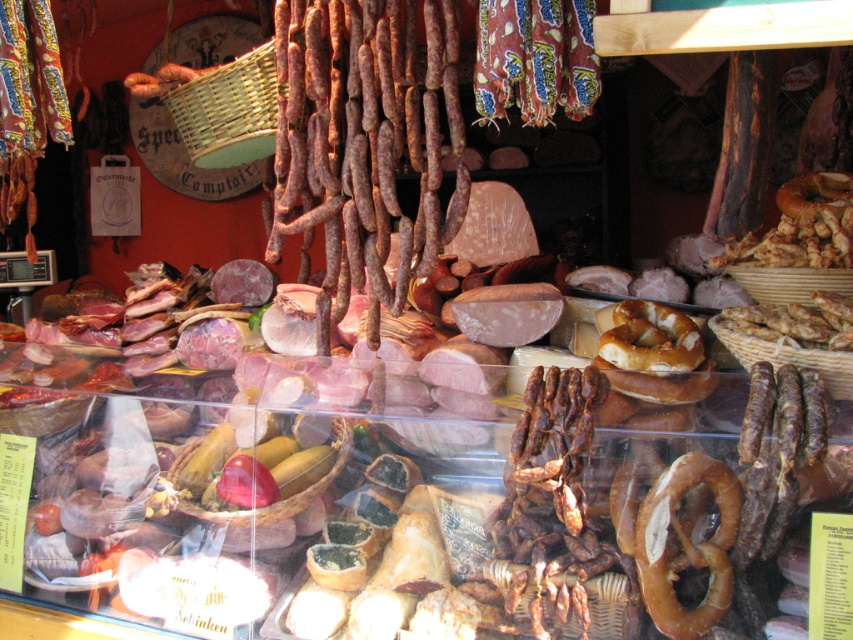
Can you confirm if brown/crumbly bagel at center is positioned above brown matte bagel at center-right?

Actually, brown/crumbly bagel at center is below brown matte bagel at center-right.

This screenshot has height=640, width=853. I want to click on brown/crumbly bagel at center, so click(x=650, y=339).

Does golden brown pretzel at center appear under brown/crumbly bagel at center?

Correct, golden brown pretzel at center is located below brown/crumbly bagel at center.

Can you confirm if golden brown pretzel at center is bigger than brown/crumbly bagel at center?

No, golden brown pretzel at center is not bigger than brown/crumbly bagel at center.

Is point (665, 496) behind point (672, 323)?

That is False.

Locate an element on the screen. golden brown pretzel at center is located at coordinates (685, 545).

Consider the image. Is golden brown pretzel at center below brown matte bagel at center-right?

Yes, golden brown pretzel at center is below brown matte bagel at center-right.

Does golden brown pretzel at center lie behind brown matte bagel at center-right?

No.

Does point (703, 561) come in front of point (804, 198)?

Yes, point (703, 561) is closer to viewer.

Find the location of a particular element. The height and width of the screenshot is (640, 853). golden brown pretzel at center is located at coordinates [x=685, y=545].